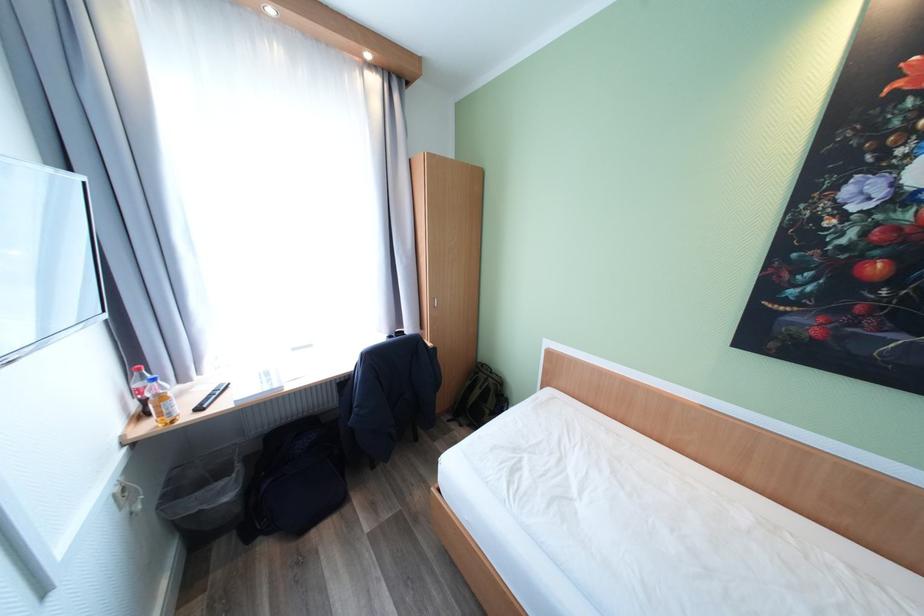
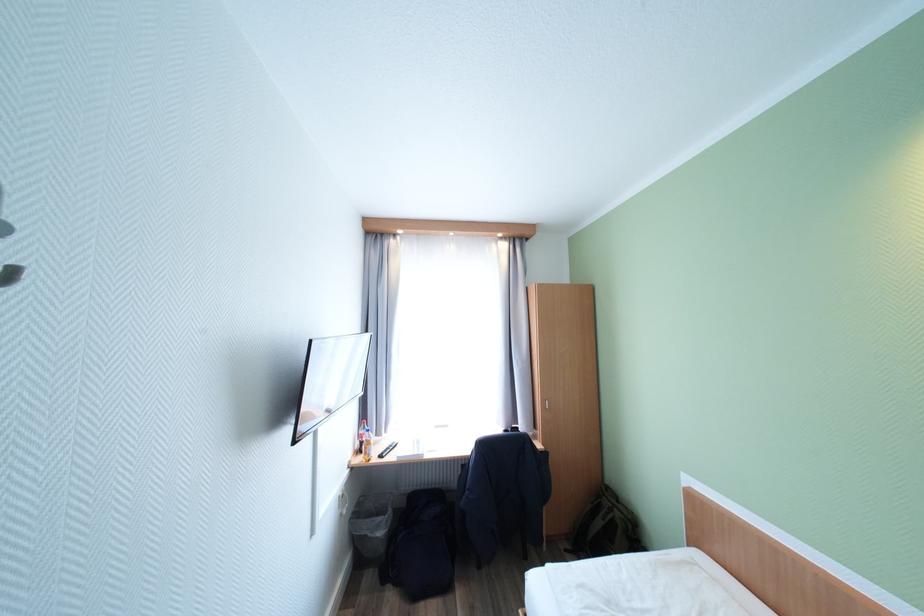
The point at (244, 511) is marked in the first image. Where is the corresponding point in the second image?

(390, 551)